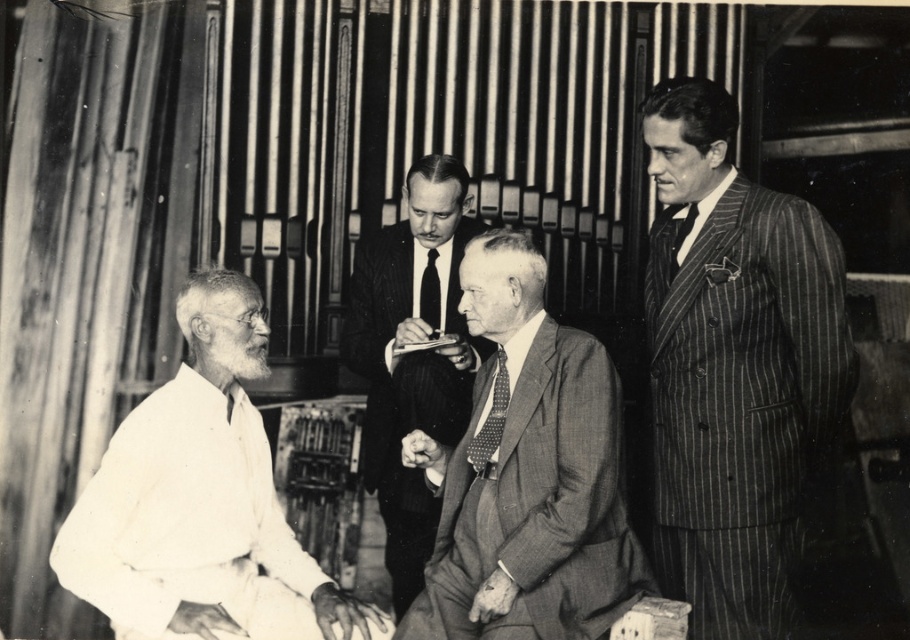
Question: Among these objects, which one is farthest from the camera?

Choices:
 (A) gray textured suit at center
 (B) dotted fabric tie at center
 (C) striped wool suit at right

Answer: (B)

Question: Can you confirm if striped wool suit at right is positioned below gray textured suit at center?

Choices:
 (A) no
 (B) yes

Answer: (A)

Question: Which object is the closest to the gray textured suit at center?

Choices:
 (A) smooth black suit at center
 (B) dotted fabric tie at center
 (C) black silk tie at center
 (D) striped wool suit at right

Answer: (B)

Question: In this image, where is gray textured suit at center located relative to black silk tie at right?

Choices:
 (A) below
 (B) above

Answer: (A)

Question: Considering the relative positions of black silk tie at center and black silk tie at right in the image provided, where is black silk tie at center located with respect to black silk tie at right?

Choices:
 (A) left
 (B) right

Answer: (A)

Question: Which is nearer to the striped wool suit at right?

Choices:
 (A) smooth black suit at center
 (B) dotted fabric tie at center
 (C) white cotton shirt at left

Answer: (B)